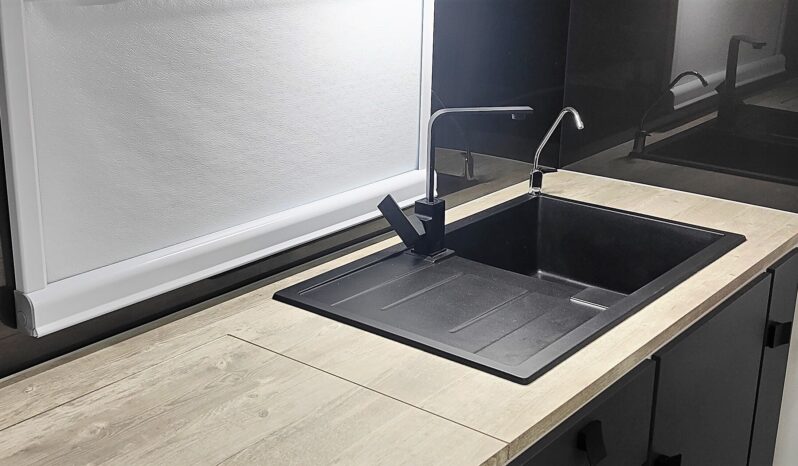
You are a GUI agent. You are given a task and a screenshot of the screen. Output one action in this format:
    pyautogui.click(x=<x>, y=<y>)
    Task: Click on the wooden counter to the right of sink
    This screenshot has width=798, height=466.
    Given the screenshot: What is the action you would take?
    pyautogui.click(x=668, y=200)